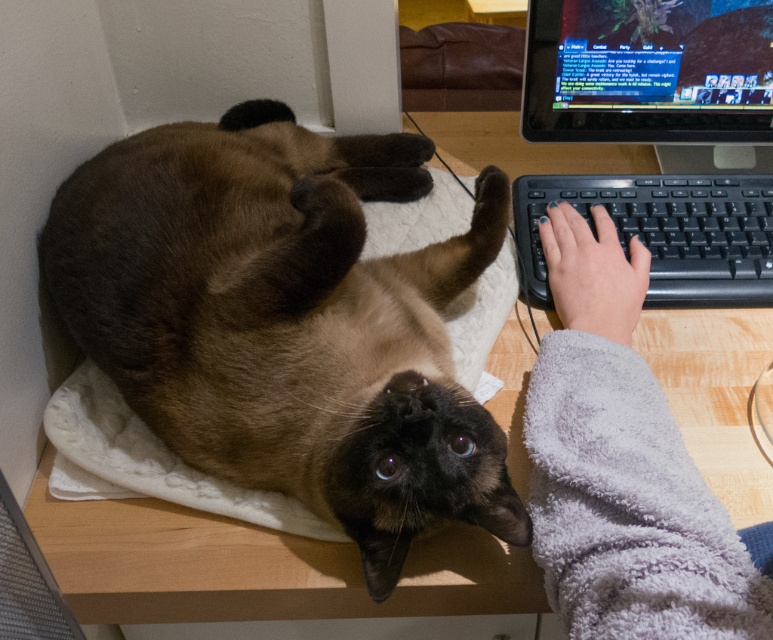
Question: Can you confirm if black plastic keyboard at upper right is positioned to the right of black plastic keyboard at right?

Choices:
 (A) yes
 (B) no

Answer: (B)

Question: Which point appears farthest from the camera in this image?

Choices:
 (A) (594, 28)
 (B) (220, 288)

Answer: (A)

Question: Which of these objects is positioned farthest from the gray fuzzy sleeve at lower right?

Choices:
 (A) black plastic keyboard at right
 (B) black plastic keyboard at upper right
 (C) shiny plastic monitor at upper right

Answer: (C)

Question: Considering the relative positions of gray fuzzy sleeve at lower right and shiny plastic monitor at upper right in the image provided, where is gray fuzzy sleeve at lower right located with respect to shiny plastic monitor at upper right?

Choices:
 (A) above
 (B) below

Answer: (B)

Question: Is gray fuzzy sleeve at lower right in front of shiny plastic monitor at upper right?

Choices:
 (A) no
 (B) yes

Answer: (B)

Question: Which point is farther to the camera?

Choices:
 (A) (690, 296)
 (B) (710, 128)
 (C) (768, 35)

Answer: (B)